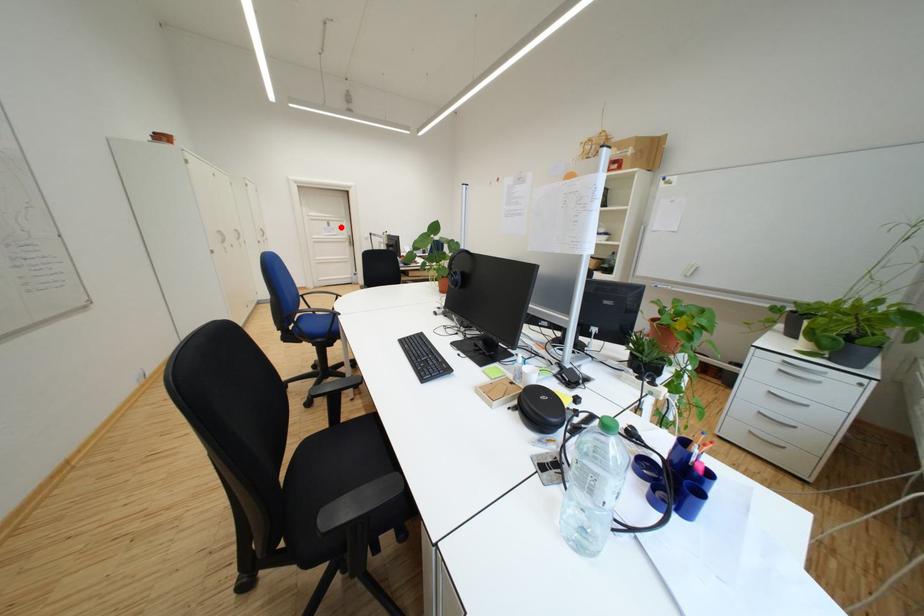
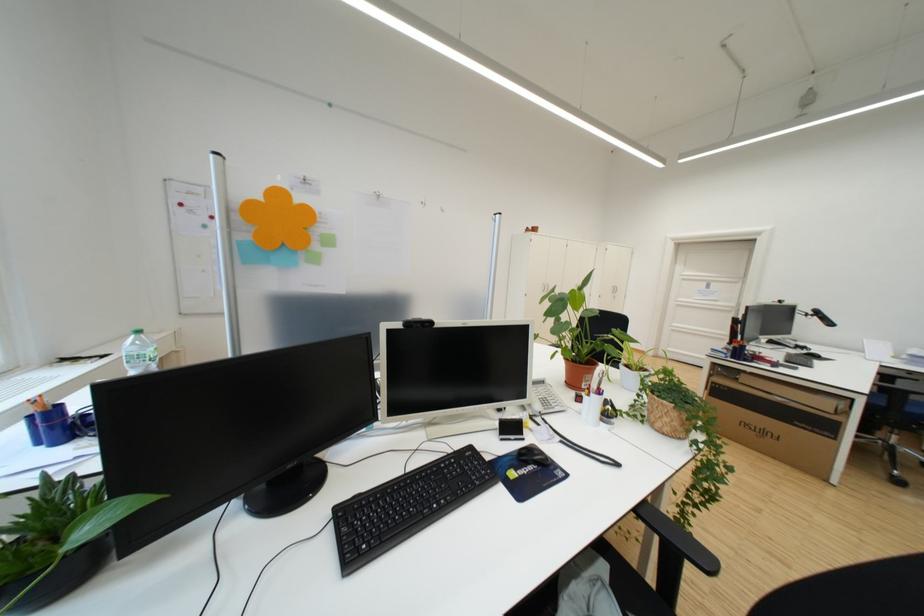
Question: I am providing you with two images of the same scene from different viewpoints. A red point is marked on the first image. Can you still see the location of the red point in image 2?

Choices:
 (A) Yes
 (B) No

Answer: (A)